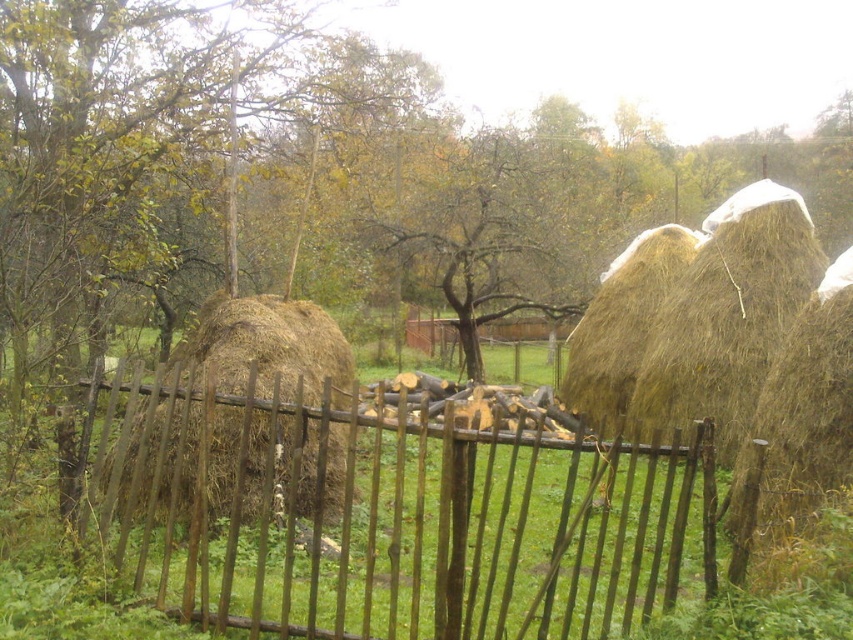
Question: Which object is farther from the camera taking this photo?

Choices:
 (A) brown rough hay at left
 (B) yellow-green foliage at center
 (C) brown straw bale at right
 (D) brown wooden fence at center

Answer: (B)

Question: Does brown wooden fence at center appear on the left side of brown rough hay at left?

Choices:
 (A) yes
 (B) no

Answer: (B)

Question: Which object appears closest to the camera in this image?

Choices:
 (A) golden straw bale at center
 (B) brown rough hay at left

Answer: (B)

Question: Is brown wooden fence at center further to the viewer compared to brown straw bale at right?

Choices:
 (A) no
 (B) yes

Answer: (B)

Question: Can you confirm if brown rough hay at left is thinner than yellow-green foliage at center?

Choices:
 (A) no
 (B) yes

Answer: (B)

Question: Which point is closer to the camera?

Choices:
 (A) (808, 220)
 (B) (541, 600)

Answer: (B)